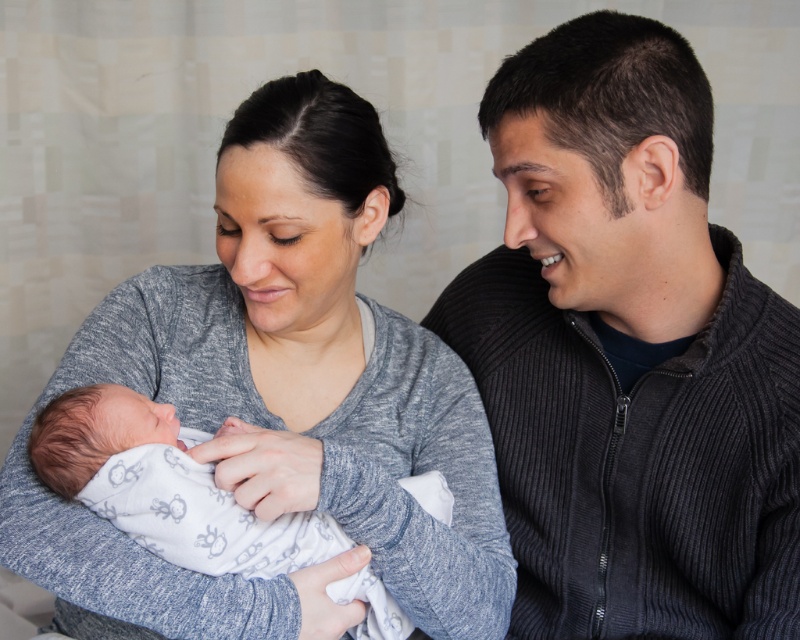
Which is above, dark gray corduroy sweater at right or gray soft fabric baby at center?

dark gray corduroy sweater at right is higher up.

Is dark gray corduroy sweater at right positioned before gray soft fabric baby at center?

No, it is not.

Which is behind, point (666, 243) or point (274, 136)?

Point (666, 243)

Find the location of `dark gray corduroy sweater at right`. dark gray corduroy sweater at right is located at coordinates (628, 353).

Is dark gray corduroy sweater at right positioned before white soft fabric newborn at center?

That is False.

Does point (542, 506) come closer to viewer compared to point (188, 557)?

No, (542, 506) is further to viewer.

Locate an element on the screen. dark gray corduroy sweater at right is located at coordinates (628, 353).

Is gray soft fabric baby at center bigger than white soft fabric newborn at center?

Yes.

Is gray soft fabric baby at center further to camera compared to white soft fabric newborn at center?

No, it is in front of white soft fabric newborn at center.

Image resolution: width=800 pixels, height=640 pixels. In order to click on gray soft fabric baby at center in this screenshot , I will do `click(314, 356)`.